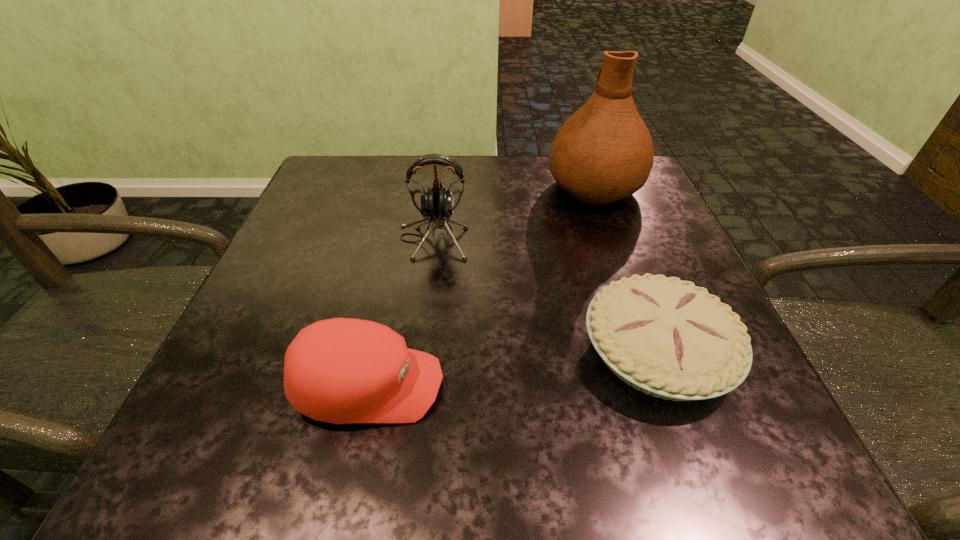
In the image, there is a desktop. What are the coordinates of `free region at the left edge` in the screenshot? It's located at (300, 252).

In the image, there is a desktop. Find the location of `free space at the right edge`. free space at the right edge is located at coordinates (606, 224).

In order to click on free space at the far left corner in this screenshot , I will do `click(364, 208)`.

Where is `vacant space at the far right corner`? vacant space at the far right corner is located at coordinates (618, 201).

You are a GUI agent. You are given a task and a screenshot of the screen. Output one action in this format:
    pyautogui.click(x=<x>, y=<y>)
    Task: Click on the vacant area at the near right corner of the desktop
    Image resolution: width=960 pixels, height=540 pixels.
    Given the screenshot: What is the action you would take?
    pyautogui.click(x=720, y=447)

Image resolution: width=960 pixels, height=540 pixels. Find the location of `free space between the second farthest object and the shortest object`. free space between the second farthest object and the shortest object is located at coordinates (545, 295).

This screenshot has height=540, width=960. Identify the location of vacant space that's between the third tallest object and the farthest object. (481, 286).

The width and height of the screenshot is (960, 540). Find the location of `blank region between the second shortest object and the tallest object`. blank region between the second shortest object and the tallest object is located at coordinates (481, 286).

At what (x,y) coordinates should I click in order to perform the action: click on vacant space in between the third nearest object and the farthest object. Please return your answer as a coordinate pair (x, y). Looking at the image, I should click on click(514, 213).

Image resolution: width=960 pixels, height=540 pixels. In order to click on unoccupied position between the pie and the earphone in this screenshot , I will do `click(545, 295)`.